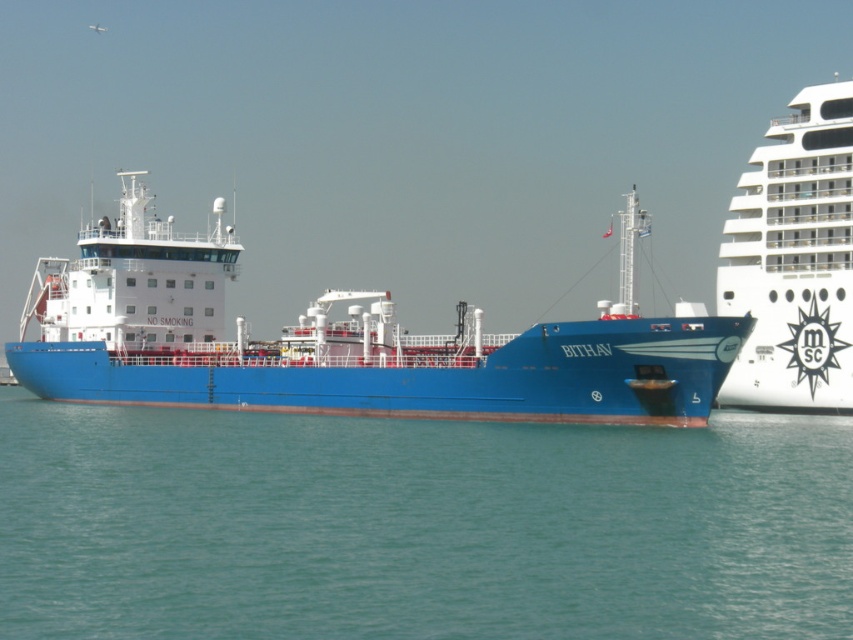
You are standing at the camera position and want to reach the point at coordinates (352,536). The cargo ship BITHAV is docked on the left, and the MSC cruise ship is on the right. Considering the vessels are in your way, which ship would you need to navigate around to reach the point?

To reach the point at coordinates (352,536), you would need to navigate around the MSC cruise ship on the right since the point is closer to the right side of the image and the cruise ship is partially blocking that area.

You are a photographer standing on the dock and want to capture a photo of the teal water at center and the blue matte ship at center. Which object will appear larger in your photo?

The teal water at center will appear larger in the photo because it is closer to the viewer than the blue matte ship at center.